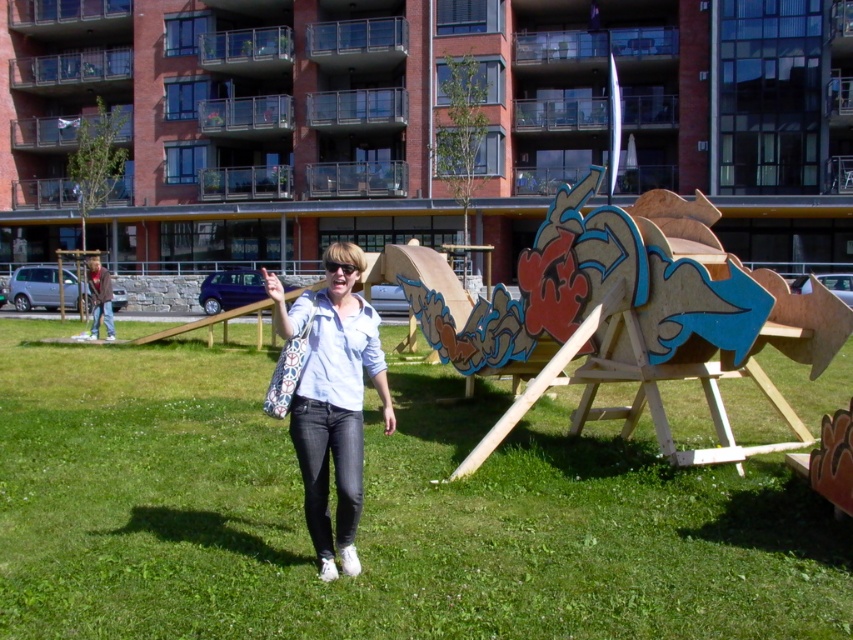
You are standing in the park and see the green grass at center and the matte white shirt at center. Which object is located to the right of the other?

The green grass at center is positioned on the right side of matte white shirt at center.

You are a photographer standing in front of the modern residential building. You notice the green grass at center and the matte white shirt at center. Which object is closer to you?

The green grass at center is closer to you because it is further to the viewer than the matte white shirt at center.

You are standing at the camera position and want to reach the point marked at coordinates (x=717, y=417). If your walking speed is 3 feet per second, how many seconds will it take you to reach that point?

The point marked at coordinates (x=717, y=417) is 21.77 feet away from the camera. At a walking speed of 3 feet per second, it would take approximately 7.26 seconds to reach the point. Since the question asks for the time in seconds, rounding to two decimal places gives 7.26 seconds.